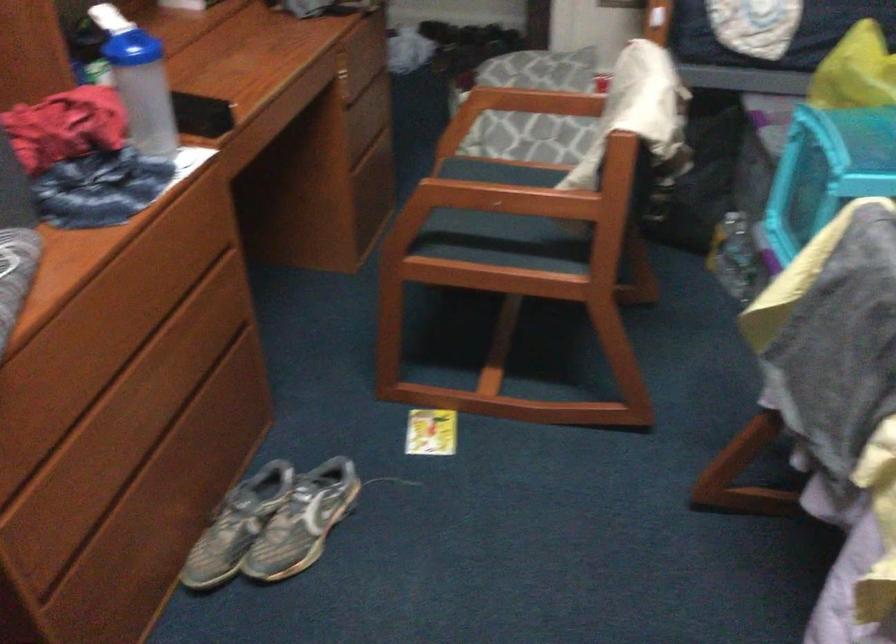
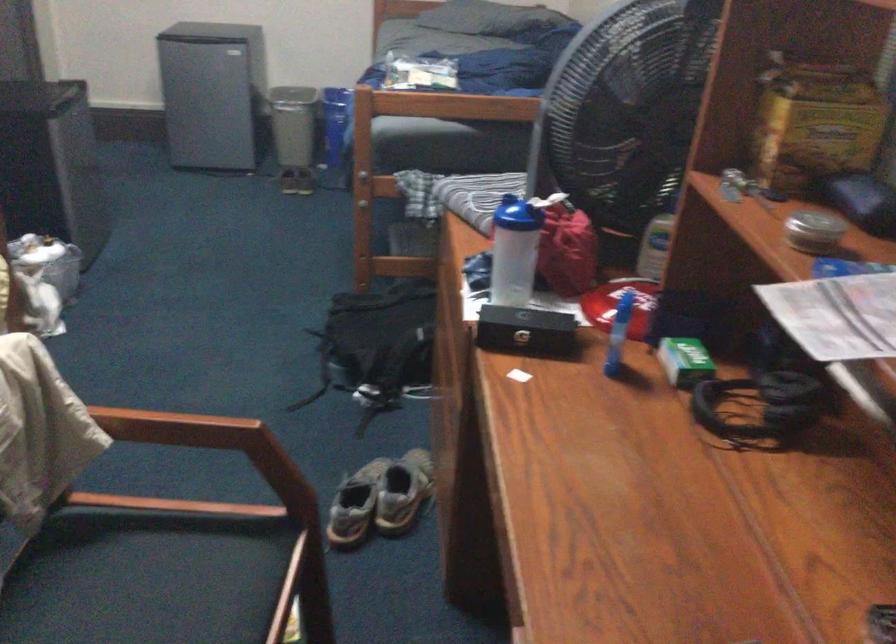
Question: I am providing you with two images of the same scene from different viewpoints. Which of the following objects are not visible in image2?

Choices:
 (A) gray sneaker
 (B) round metal tin
 (C) yellow cardboard box
 (D) none of these

Answer: (D)